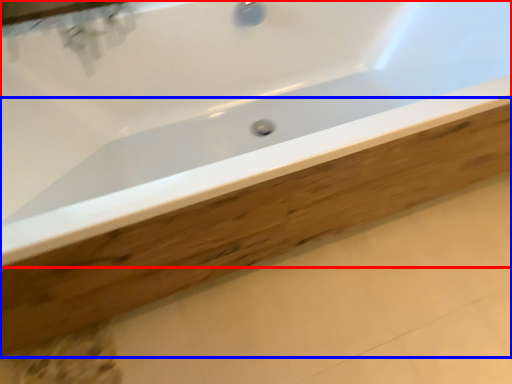
Question: Which point is further to the camera, bathtub (highlighted by a red box) or plank (highlighted by a blue box)?

Choices:
 (A) bathtub
 (B) plank

Answer: (B)